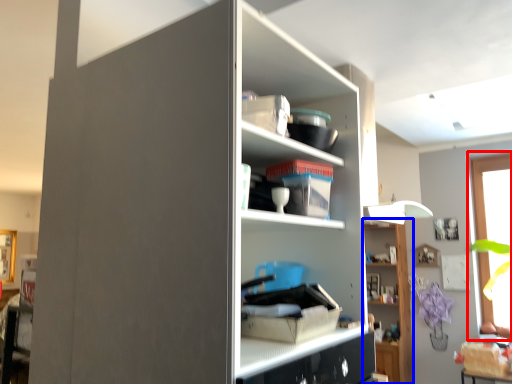
Question: Which object is closer to the camera taking this photo, window (highlighted by a red box) or shelf (highlighted by a blue box)?

Choices:
 (A) window
 (B) shelf

Answer: (A)